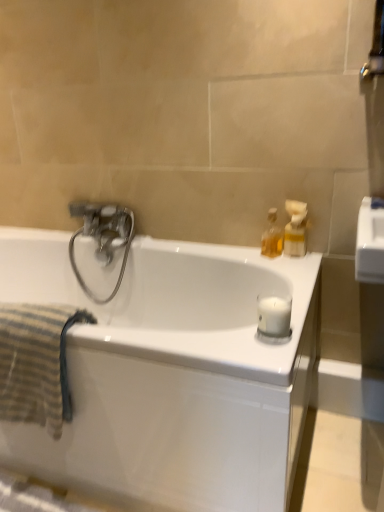
The height and width of the screenshot is (512, 384). I want to click on vacant space to the left of translucent glass bottle at upper right, which is counted as the 1th soap dispenser, starting from the left, so click(x=243, y=252).